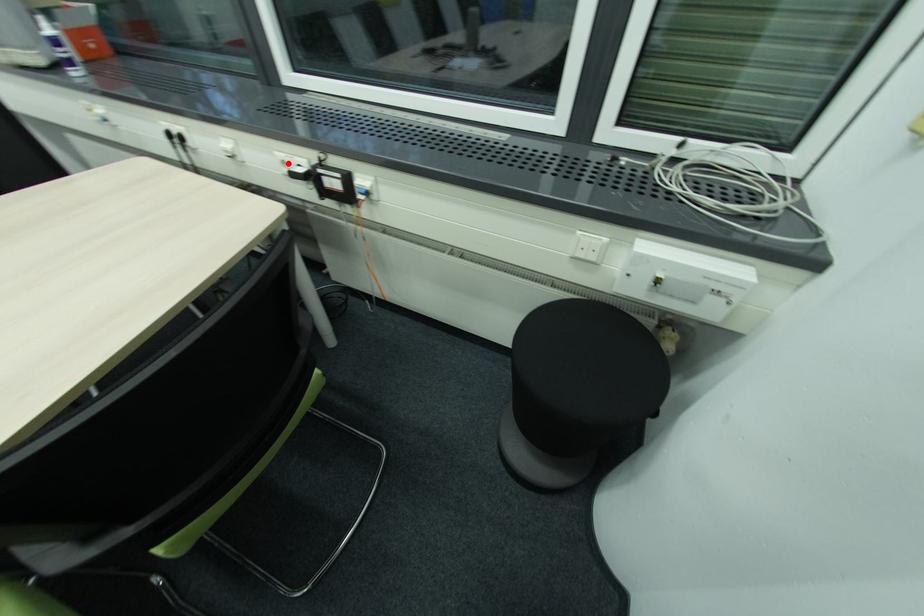
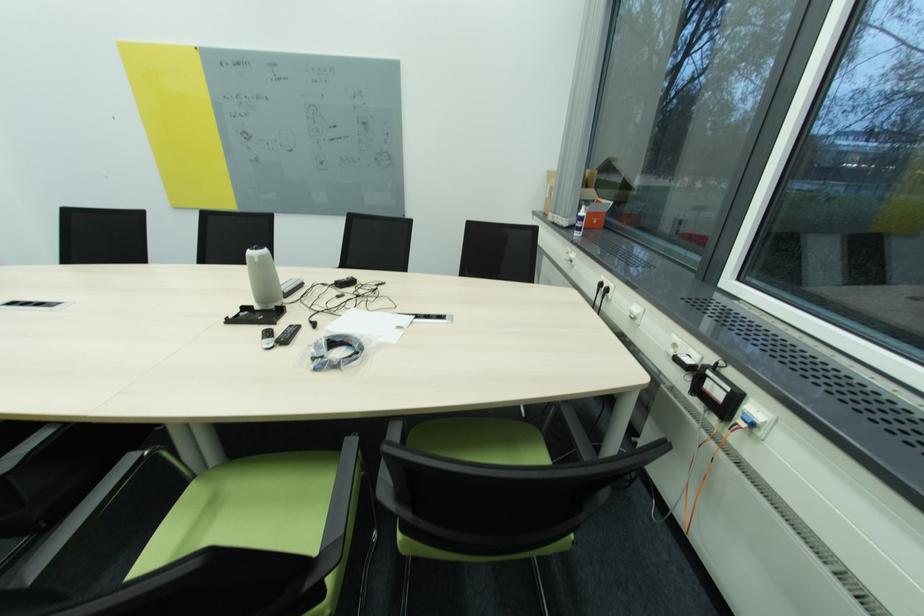
Find the pixel in the second image that matches the highlighted location in the first image.

(679, 346)